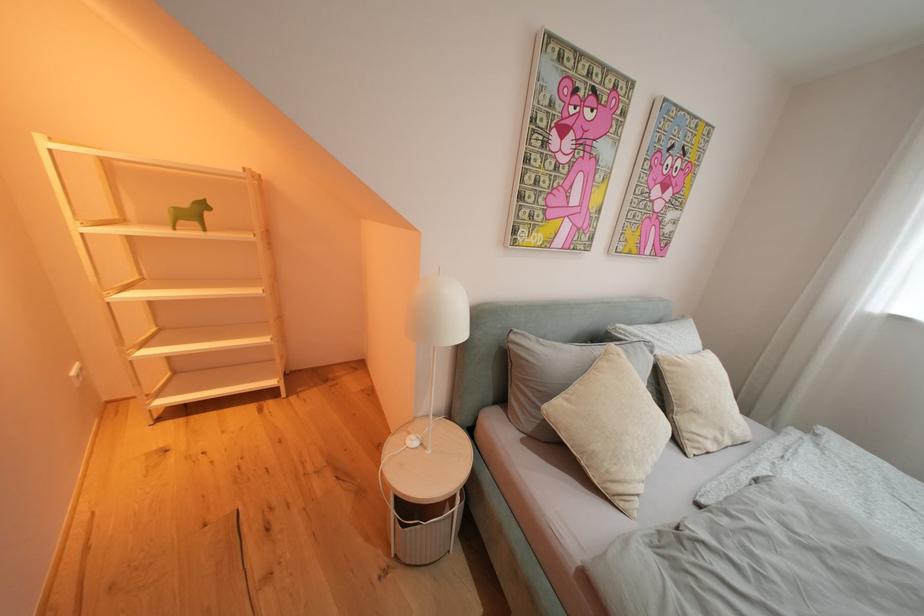
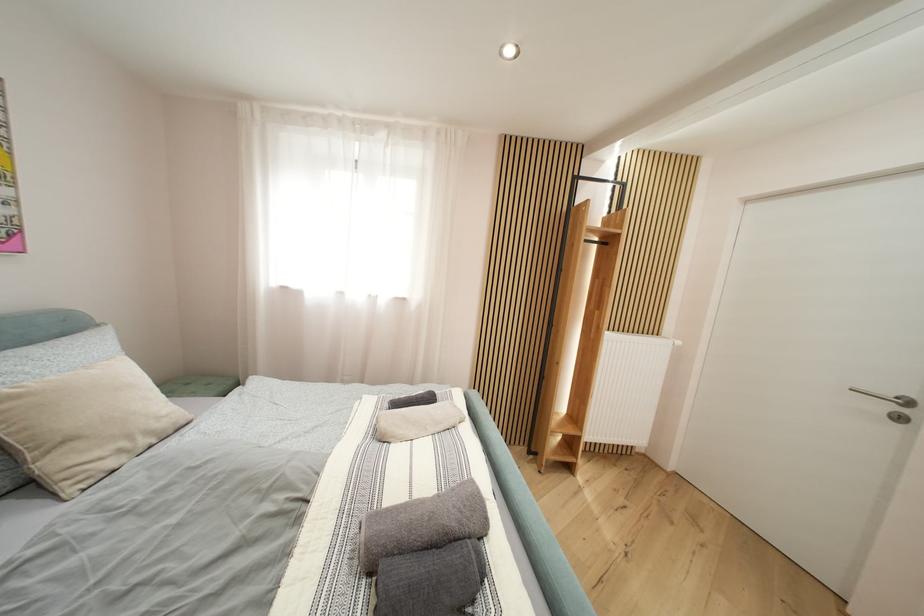
Question: How did the camera likely rotate?

Choices:
 (A) Left
 (B) Right
 (C) Up
 (D) Down

Answer: (B)